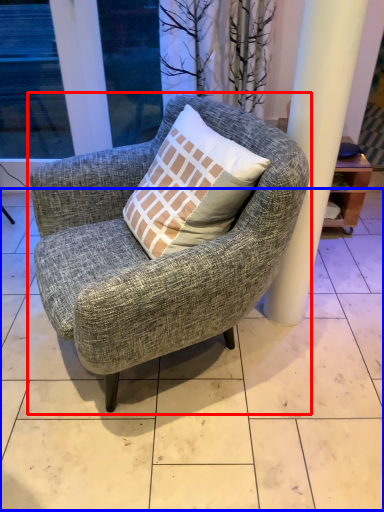
Question: Which object is closer to the camera taking this photo, chair (highlighted by a red box) or tile (highlighted by a blue box)?

Choices:
 (A) chair
 (B) tile

Answer: (A)